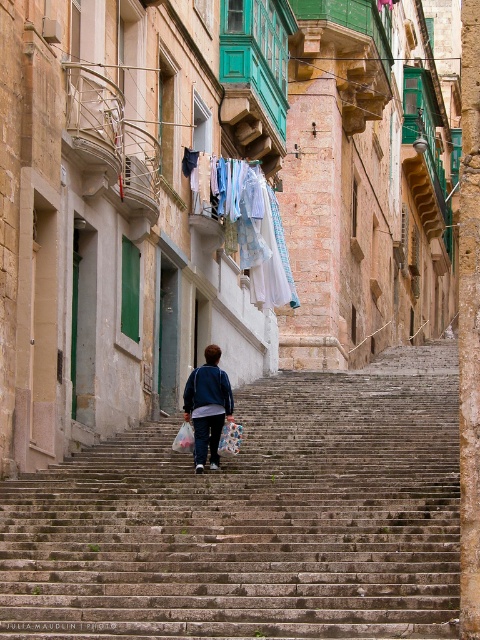
Question: Which object is farther from the camera taking this photo?

Choices:
 (A) stone stairs at center
 (B) plastic bag at center
 (C) blue fleece jacket at center
 (D) light blue fabric at upper center

Answer: (D)

Question: Does stone stairs at center come behind blue fleece jacket at center?

Choices:
 (A) no
 (B) yes

Answer: (A)

Question: Which of these objects is positioned closest to the light blue fabric at upper center?

Choices:
 (A) blue fleece jacket at center
 (B) stone stairs at center
 (C) plastic bag at center

Answer: (A)

Question: Which of these objects is positioned closest to the blue fleece jacket at center?

Choices:
 (A) plastic bag at center
 (B) light blue fabric at upper center
 (C) stone stairs at center

Answer: (A)

Question: Does light blue fabric at upper center come in front of plastic bag at center?

Choices:
 (A) no
 (B) yes

Answer: (A)

Question: Can you confirm if blue fleece jacket at center is positioned below plastic bag at center?

Choices:
 (A) no
 (B) yes

Answer: (A)